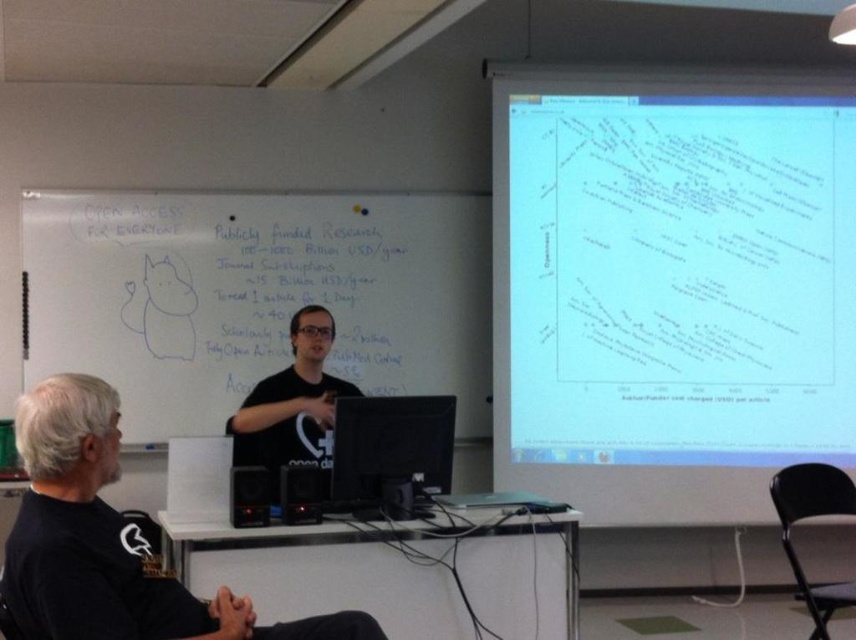
Is black t-shirt at center bigger than black plastic monitor at center?

Yes.

Which is more to the left, black t-shirt at center or black plastic monitor at center?

From the viewer's perspective, black t-shirt at center appears more on the left side.

Does point (43, 429) lie in front of point (397, 452)?

Yes, it is in front of point (397, 452).

Locate an element on the screen. black t-shirt at center is located at coordinates (108, 541).

Can you confirm if white matte projector screen at upper right is shorter than black t-shirt at center?

No, white matte projector screen at upper right is not shorter than black t-shirt at center.

Can you confirm if white matte projector screen at upper right is taller than black t-shirt at center?

Indeed, white matte projector screen at upper right has a greater height compared to black t-shirt at center.

Image resolution: width=856 pixels, height=640 pixels. What are the coordinates of `white matte projector screen at upper right` in the screenshot? It's located at (670, 288).

Based on the photo, who is positioned more to the right, white matte projector screen at upper right or black plastic monitor at center?

Positioned to the right is white matte projector screen at upper right.

Can you confirm if white matte projector screen at upper right is taller than black plastic monitor at center?

Yes, white matte projector screen at upper right is taller than black plastic monitor at center.

This screenshot has width=856, height=640. Identify the location of white matte projector screen at upper right. (670, 288).